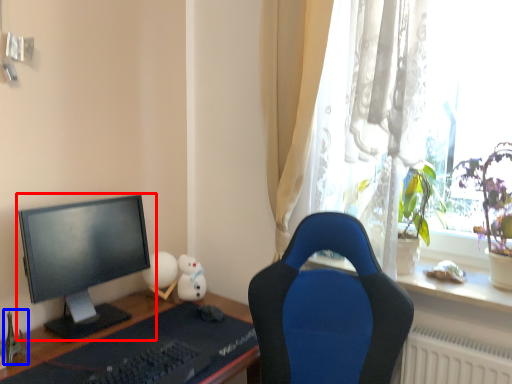
Question: Which point is further to the camera, computer monitor (highlighted by a red box) or toy (highlighted by a blue box)?

Choices:
 (A) computer monitor
 (B) toy

Answer: (B)